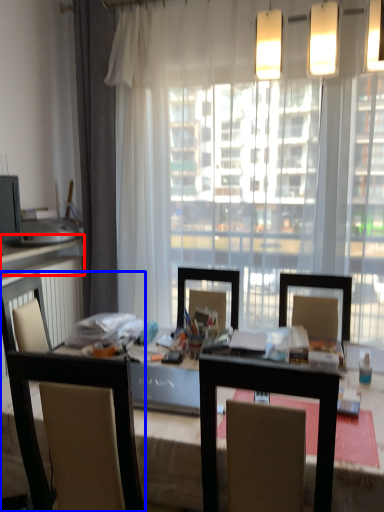
Question: Which object is further to the camera taking this photo, counter top (highlighted by a red box) or chair (highlighted by a blue box)?

Choices:
 (A) counter top
 (B) chair

Answer: (A)